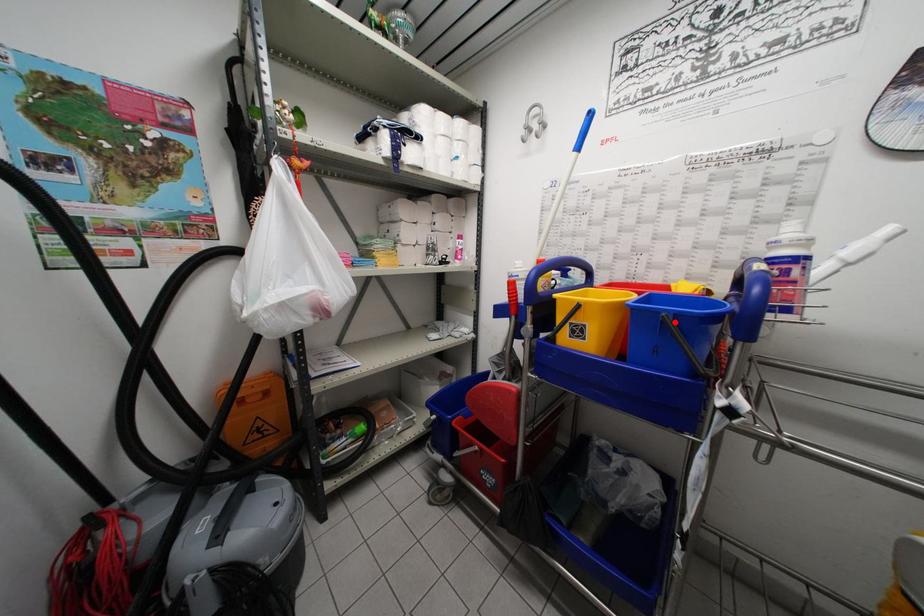
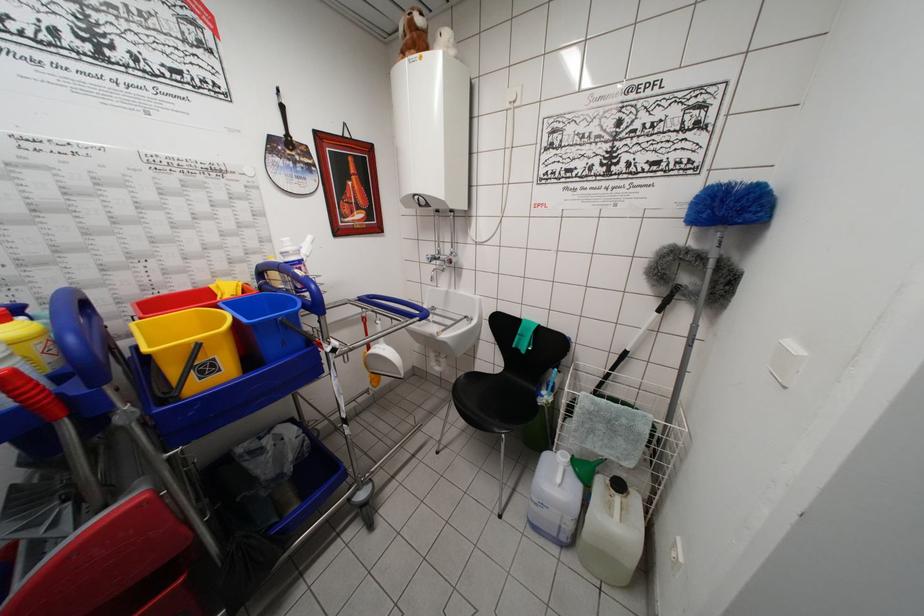
The point at the highlighted location is marked in the first image. Where is the corresponding point in the second image?

(287, 323)